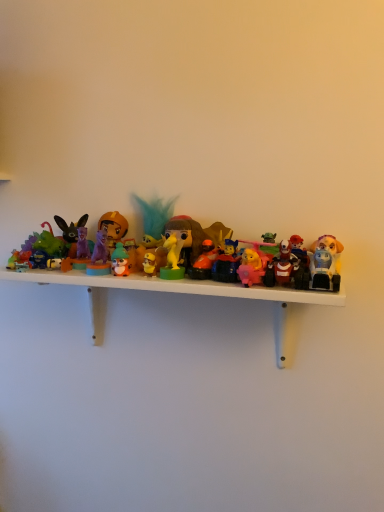
Question: Is matte orange helmet at center, acting as the 10th toy starting from the right, further to the viewer compared to matte plastic figure at center-right, the 2th toy when ordered from right to left?

Choices:
 (A) yes
 (B) no

Answer: (A)

Question: Is matte plastic figure at center-right, which ranks as the twelfth toy in left-to-right order, a part of matte orange helmet at center, the fourth toy in the left-to-right sequence?

Choices:
 (A) yes
 (B) no

Answer: (B)

Question: From a real-world perspective, is matte orange helmet at center, the fourth toy in the left-to-right sequence, on matte plastic figure at center-right, which ranks as the twelfth toy in left-to-right order?

Choices:
 (A) no
 (B) yes

Answer: (B)

Question: Is matte orange helmet at center, acting as the 10th toy starting from the right, bigger than matte plastic figure at center-right, which ranks as the twelfth toy in left-to-right order?

Choices:
 (A) no
 (B) yes

Answer: (B)

Question: From the image's perspective, is matte orange helmet at center, the fourth toy in the left-to-right sequence, on matte plastic figure at center-right, which ranks as the twelfth toy in left-to-right order?

Choices:
 (A) yes
 (B) no

Answer: (A)

Question: Does matte orange helmet at center, acting as the 10th toy starting from the right, have a greater width compared to matte plastic figure at center-right, which ranks as the twelfth toy in left-to-right order?

Choices:
 (A) no
 (B) yes

Answer: (A)

Question: Can you confirm if plastic toys at center is wider than teal feather at center, arranged as the 6th toy when viewed from the left?

Choices:
 (A) yes
 (B) no

Answer: (A)

Question: Could you tell me if plastic toys at center is facing teal feather at center, arranged as the 6th toy when viewed from the left?

Choices:
 (A) no
 (B) yes

Answer: (A)

Question: Does plastic toys at center come in front of teal feather at center, arranged as the 6th toy when viewed from the left?

Choices:
 (A) no
 (B) yes

Answer: (B)

Question: Is plastic toys at center smaller than teal feather at center, the 8th toy from the right?

Choices:
 (A) no
 (B) yes

Answer: (A)

Question: Is plastic toys at center outside of teal feather at center, the 8th toy from the right?

Choices:
 (A) yes
 (B) no

Answer: (A)

Question: Could teal feather at center, the 8th toy from the right, be considered to be inside plastic toys at center?

Choices:
 (A) no
 (B) yes

Answer: (A)

Question: Is plush yellow dog at right, positioned as the 1th toy in right-to-left order, wider than pink plastic bear at center, which is counted as the 3th toy, starting from the right?

Choices:
 (A) no
 (B) yes

Answer: (A)